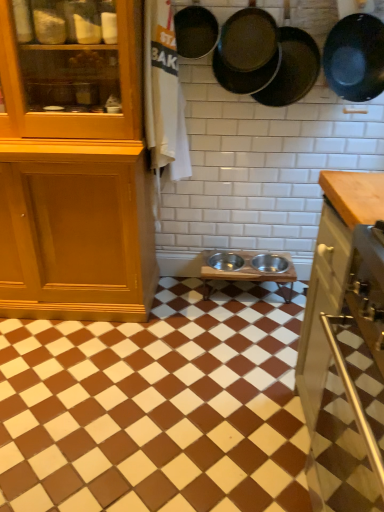
Question: Is black matte frying pan at upper right, the 4th frying pan viewed from the left, closer to the viewer compared to metallic silver bowls at center?

Choices:
 (A) no
 (B) yes

Answer: (A)

Question: Can you confirm if black matte frying pan at upper right, which is the 1th frying pan from right to left, is taller than metallic silver bowls at center?

Choices:
 (A) no
 (B) yes

Answer: (B)

Question: Is black matte frying pan at upper right, which is the 1th frying pan from right to left, turned away from metallic silver bowls at center?

Choices:
 (A) no
 (B) yes

Answer: (A)

Question: Is black matte frying pan at upper right, the 4th frying pan viewed from the left, in contact with metallic silver bowls at center?

Choices:
 (A) yes
 (B) no

Answer: (B)

Question: From a real-world perspective, is black matte frying pan at upper right, which is the 1th frying pan from right to left, below metallic silver bowls at center?

Choices:
 (A) no
 (B) yes

Answer: (A)

Question: In terms of width, does dark brown matte frying pan at upper right, placed as the 2th frying pan when sorted from left to right, look wider or thinner when compared to black matte frying pan at upper right, which is the 1th frying pan from right to left?

Choices:
 (A) wide
 (B) thin

Answer: (B)

Question: Is dark brown matte frying pan at upper right, which is the third frying pan in right-to-left order, taller or shorter than black matte frying pan at upper right, the 4th frying pan viewed from the left?

Choices:
 (A) short
 (B) tall

Answer: (A)

Question: Relative to black matte frying pan at upper right, which is the 1th frying pan from right to left, is dark brown matte frying pan at upper right, which is the third frying pan in right-to-left order, in front or behind?

Choices:
 (A) behind
 (B) front

Answer: (A)

Question: Is dark brown matte frying pan at upper right, which is the third frying pan in right-to-left order, bigger or smaller than black matte frying pan at upper right, the 4th frying pan viewed from the left?

Choices:
 (A) small
 (B) big

Answer: (A)

Question: Is black matte frying pan at upper right, the 4th frying pan viewed from the left, in front of or behind matte black frying pan at upper center, which appears as the fourth frying pan when viewed from the right, in the image?

Choices:
 (A) front
 (B) behind

Answer: (A)

Question: Is black matte frying pan at upper right, the 4th frying pan viewed from the left, spatially inside matte black frying pan at upper center, the first frying pan viewed from the left, or outside of it?

Choices:
 (A) outside
 (B) inside

Answer: (A)

Question: From their relative heights in the image, would you say black matte frying pan at upper right, which is the 1th frying pan from right to left, is taller or shorter than matte black frying pan at upper center, which appears as the fourth frying pan when viewed from the right?

Choices:
 (A) short
 (B) tall

Answer: (B)

Question: Does point (365, 74) appear closer or farther from the camera than point (190, 57)?

Choices:
 (A) farther
 (B) closer

Answer: (B)

Question: From their relative heights in the image, would you say dark brown matte frying pan at upper right, which is the third frying pan in right-to-left order, is taller or shorter than matte black frying pan at upper right, which is counted as the 3th frying pan, starting from the left?

Choices:
 (A) short
 (B) tall

Answer: (A)

Question: In terms of width, does dark brown matte frying pan at upper right, placed as the 2th frying pan when sorted from left to right, look wider or thinner when compared to matte black frying pan at upper right, which is counted as the 3th frying pan, starting from the left?

Choices:
 (A) wide
 (B) thin

Answer: (B)